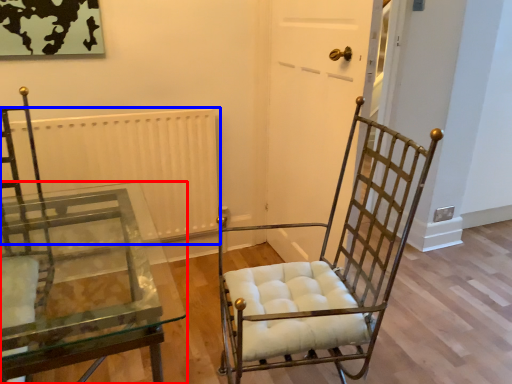
Question: Which object is closer to the camera taking this photo, table (highlighted by a red box) or radiator (highlighted by a blue box)?

Choices:
 (A) table
 (B) radiator

Answer: (A)